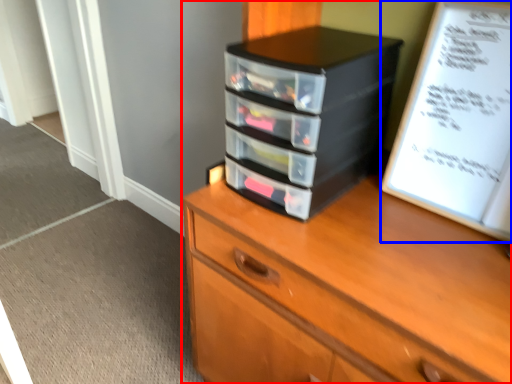
Question: Among these objects, which one is farthest to the camera, chest of drawers (highlighted by a red box) or paperback book (highlighted by a blue box)?

Choices:
 (A) chest of drawers
 (B) paperback book

Answer: (B)